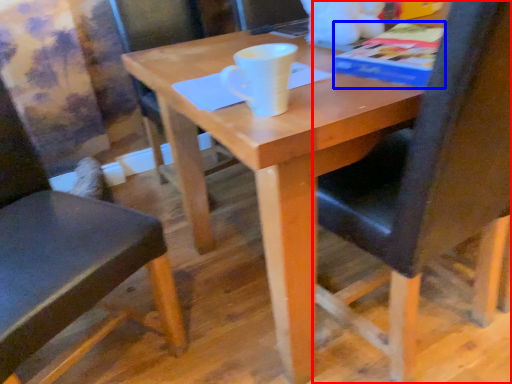
Question: Which of the following is the closest to the observer, chair (highlighted by a red box) or paperback book (highlighted by a blue box)?

Choices:
 (A) chair
 (B) paperback book

Answer: (A)